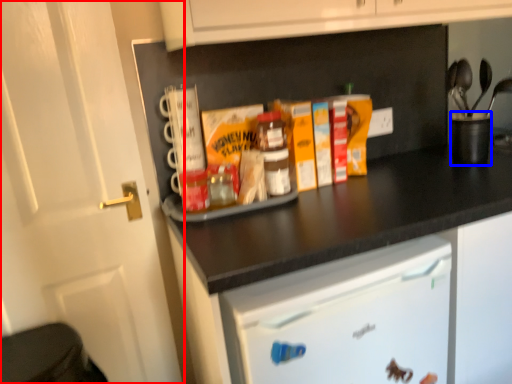
Question: Which object appears farthest to the camera in this image, door (highlighted by a red box) or appliance (highlighted by a blue box)?

Choices:
 (A) door
 (B) appliance

Answer: (B)